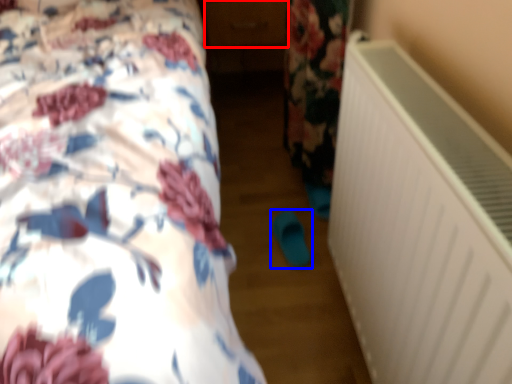
Question: Which object appears farthest to the camera in this image, drawer (highlighted by a red box) or footwear (highlighted by a blue box)?

Choices:
 (A) drawer
 (B) footwear

Answer: (A)